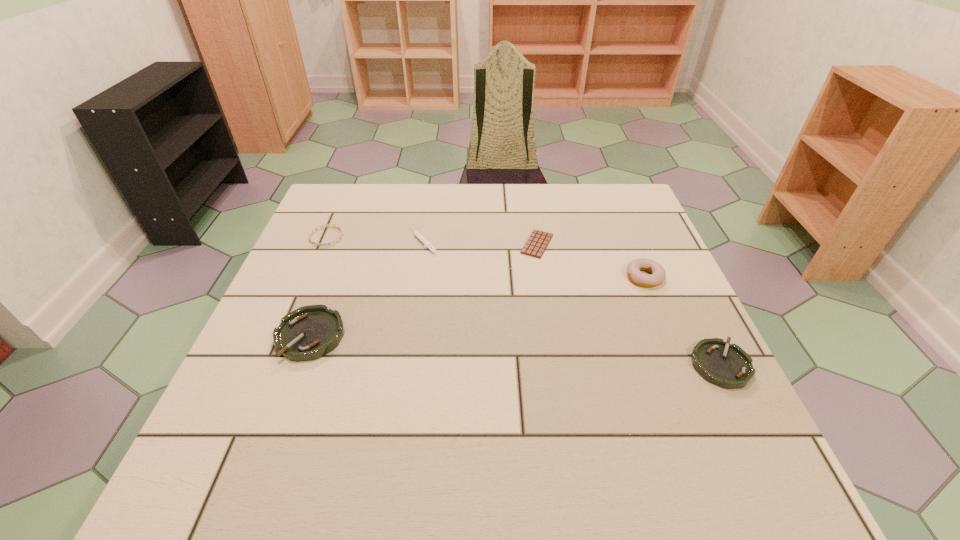
You are a GUI agent. You are given a task and a screenshot of the screen. Output one action in this format:
    pyautogui.click(x=<x>, y=<y>)
    Task: Click on the vacant space that satisfies the following two spatial constraints: 1. on the surface of the third nearest object showing star-shaped elements; 2. on the right side of the bracelet
    The height and width of the screenshot is (540, 960).
    Given the screenshot: What is the action you would take?
    pyautogui.click(x=309, y=277)

Find the location of a particular element. vacant space that satisfies the following two spatial constraints: 1. on the front side of the fourth object from left to right; 2. on the right side of the right ashtray is located at coordinates click(556, 365).

In order to click on vacant space that satisfies the following two spatial constraints: 1. on the surface of the bracelet showing star-shaped elements; 2. on the left side of the doughnut in this screenshot , I will do `click(309, 277)`.

Locate an element on the screen. free location that satisfies the following two spatial constraints: 1. on the surface of the third object from right to left showing star-shaped elements; 2. on the right side of the bracelet is located at coordinates (324, 244).

In order to click on vacant space that satisfies the following two spatial constraints: 1. on the surface of the syringe showing star-shaped elements; 2. on the left side of the bracelet in this screenshot , I will do `click(324, 241)`.